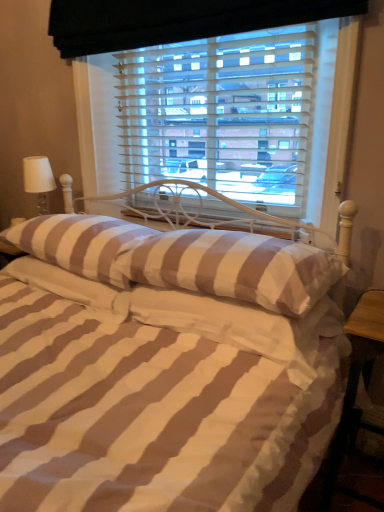
Question: In terms of size, does brown striped pillow at center, which is counted as the 2th pillow, starting from the right, appear bigger or smaller than brown striped pillow at center, which ranks as the second pillow in left-to-right order?

Choices:
 (A) small
 (B) big

Answer: (A)

Question: Relative to brown striped pillow at center, the third pillow when ordered from right to left, is brown striped pillow at center, which is counted as the 2th pillow, starting from the right, in front or behind?

Choices:
 (A) front
 (B) behind

Answer: (A)

Question: Which of these objects is positioned farthest from the wooden table at lower right?

Choices:
 (A) brown striped pillow at center, which is the 3th pillow from left to right
 (B) white fabric lampshade at left
 (C) brown striped pillow at center, marked as the 1th pillow in a left-to-right arrangement
 (D) white striped pillow at center, the 1th pillow when ordered from right to left
 (E) brown striped pillow at center, the third pillow when ordered from right to left

Answer: (B)

Question: Estimate the real-world distances between objects in this image. Which object is farther from the brown striped pillow at center, which is the 3th pillow from left to right?

Choices:
 (A) wooden table at lower right
 (B) white striped pillow at center, the 4th pillow from the left
 (C) brown striped pillow at center, marked as the 1th pillow in a left-to-right arrangement
 (D) brown striped pillow at center, which ranks as the second pillow in left-to-right order
 (E) white fabric lampshade at left

Answer: (E)